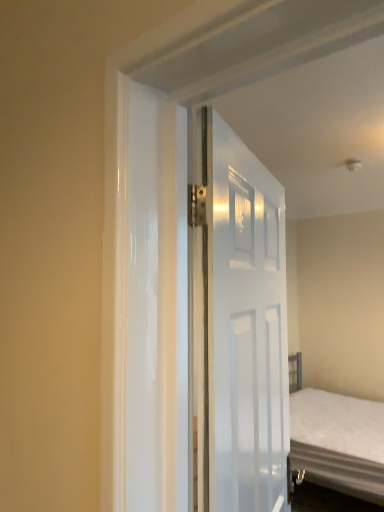
What is the approximate height of white fabric bed at center?

white fabric bed at center is 35.41 inches tall.

This screenshot has width=384, height=512. Describe the element at coordinates (337, 441) in the screenshot. I see `white fabric bed at center` at that location.

Find the location of `white fabric bed at center`. white fabric bed at center is located at coordinates (337, 441).

The height and width of the screenshot is (512, 384). What do you see at coordinates (235, 324) in the screenshot?
I see `white glossy door at center` at bounding box center [235, 324].

At what (x,y) coordinates should I click in order to perform the action: click on white glossy door at center. Please return your answer as a coordinate pair (x, y). Looking at the image, I should click on (235, 324).

Where is `white fabric bed at center`? The image size is (384, 512). white fabric bed at center is located at coordinates (337, 441).

Considering the relative positions of white glossy door at center and white fabric bed at center in the image provided, is white glossy door at center to the left of white fabric bed at center from the viewer's perspective?

Indeed, white glossy door at center is positioned on the left side of white fabric bed at center.

Relative to white fabric bed at center, is white glossy door at center in front or behind?

white glossy door at center is in front of white fabric bed at center.

Considering the points (265, 479) and (361, 471), which point is in front, point (265, 479) or point (361, 471)?

Positioned in front is point (265, 479).

From the image's perspective, would you say white glossy door at center is positioned over white fabric bed at center?

Correct, white glossy door at center appears higher than white fabric bed at center in the image.

From a real-world perspective, is white glossy door at center located higher than white fabric bed at center?

Yes, from a real-world perspective, white glossy door at center is over white fabric bed at center

Is white glossy door at center thinner than white fabric bed at center?

Indeed, white glossy door at center has a lesser width compared to white fabric bed at center.

Does white glossy door at center have a greater height compared to white fabric bed at center?

Yes.

Is white glossy door at center bigger than white fabric bed at center?

Actually, white glossy door at center might be smaller than white fabric bed at center.

Consider the image. Does white glossy door at center contain white fabric bed at center?

No, white fabric bed at center is not surrounded by white glossy door at center.

Is white glossy door at center with white fabric bed at center?

No, white glossy door at center is not with white fabric bed at center.

Is white glossy door at center turned away from white fabric bed at center?

No.

Can you tell me how much white glossy door at center and white fabric bed at center differ in facing direction?

19.5 degrees separate the facing orientations of white glossy door at center and white fabric bed at center.

The height and width of the screenshot is (512, 384). Find the location of `bed below the white glossy door at center (from a real-world perspective)`. bed below the white glossy door at center (from a real-world perspective) is located at coordinates (337, 441).

Considering the relative positions of white fabric bed at center and white glossy door at center in the image provided, is white fabric bed at center to the right of white glossy door at center from the viewer's perspective?

Correct, you'll find white fabric bed at center to the right of white glossy door at center.

Is white fabric bed at center positioned before white glossy door at center?

No.

Which is in front, point (292, 462) or point (244, 490)?

The point (244, 490) is closer to the camera.

From the image's perspective, which one is positioned higher, white fabric bed at center or white glossy door at center?

white glossy door at center, from the image's perspective.

From a real-world perspective, is white fabric bed at center physically located above or below white glossy door at center?

white fabric bed at center is situated lower than white glossy door at center in the real world.

Does white fabric bed at center have a lesser width compared to white glossy door at center?

No.

Who is taller, white fabric bed at center or white glossy door at center?

With more height is white glossy door at center.

Considering the sizes of objects white fabric bed at center and white glossy door at center in the image provided, who is smaller, white fabric bed at center or white glossy door at center?

Smaller between the two is white glossy door at center.

Is white glossy door at center inside white fabric bed at center?

No, white glossy door at center is not inside white fabric bed at center.

Are white fabric bed at center and white glossy door at center far apart?

Yes, white fabric bed at center and white glossy door at center are located far from each other.

Is white fabric bed at center looking in the opposite direction of white glossy door at center?

That's not correct — white fabric bed at center is not looking away from white glossy door at center.

Can you tell me how much white fabric bed at center and white glossy door at center differ in facing direction?

The angle between the facing direction of white fabric bed at center and the facing direction of white glossy door at center is 19.5 degrees.

Locate an element on the screen. bed that appears on the right of white glossy door at center is located at coordinates (337, 441).

Where is `door above the white fabric bed at center (from a real-world perspective)`? This screenshot has width=384, height=512. door above the white fabric bed at center (from a real-world perspective) is located at coordinates (235, 324).

You are a GUI agent. You are given a task and a screenshot of the screen. Output one action in this format:
    pyautogui.click(x=<x>, y=<y>)
    Task: Click on the bed lying behind the white glossy door at center
    The width and height of the screenshot is (384, 512).
    Given the screenshot: What is the action you would take?
    pyautogui.click(x=337, y=441)